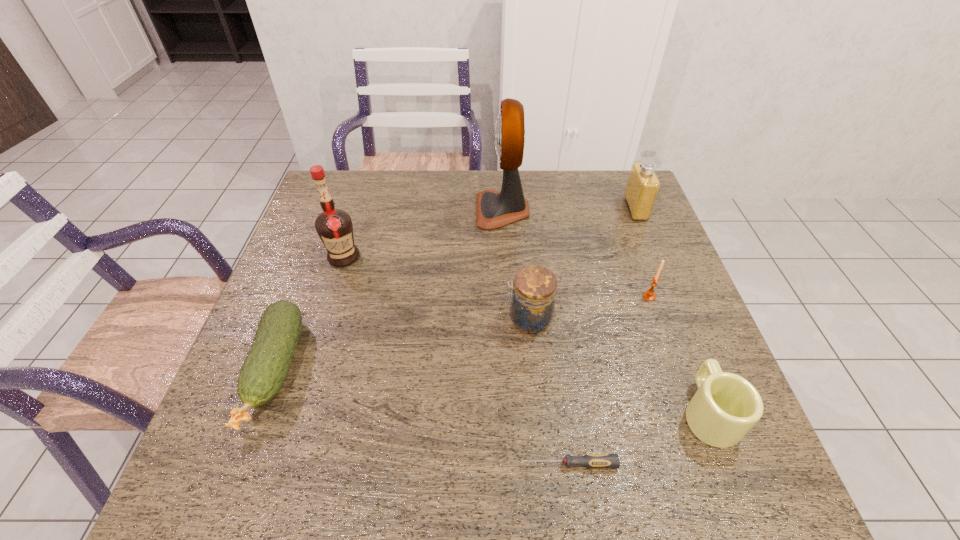
I want to click on screwdriver present at the near edge, so point(594,461).

At what (x,y) coordinates should I click in order to perform the action: click on liquor situated at the left edge. Please return your answer as a coordinate pair (x, y). Image resolution: width=960 pixels, height=540 pixels. Looking at the image, I should click on coord(334,226).

Find the location of `cucumber that is at the left edge`. cucumber that is at the left edge is located at coordinates (263, 373).

The width and height of the screenshot is (960, 540). Identify the location of perfume located in the right edge section of the desktop. (643, 185).

Find the location of a particular element. The height and width of the screenshot is (540, 960). candle_holder at the right edge is located at coordinates (649, 295).

The height and width of the screenshot is (540, 960). What are the coordinates of `mug positioned at the right edge` in the screenshot? It's located at pos(726,406).

At what (x,y) coordinates should I click in order to perform the action: click on object that is at the far right corner. Please return your answer as a coordinate pair (x, y). The width and height of the screenshot is (960, 540). Looking at the image, I should click on (643, 185).

Where is `object that is at the near right corner`? object that is at the near right corner is located at coordinates (726, 406).

Identify the location of vacant space at the far edge of the desktop. (444, 184).

In the image, there is a desktop. Where is `vacant space at the near edge`? The height and width of the screenshot is (540, 960). vacant space at the near edge is located at coordinates [x=469, y=461].